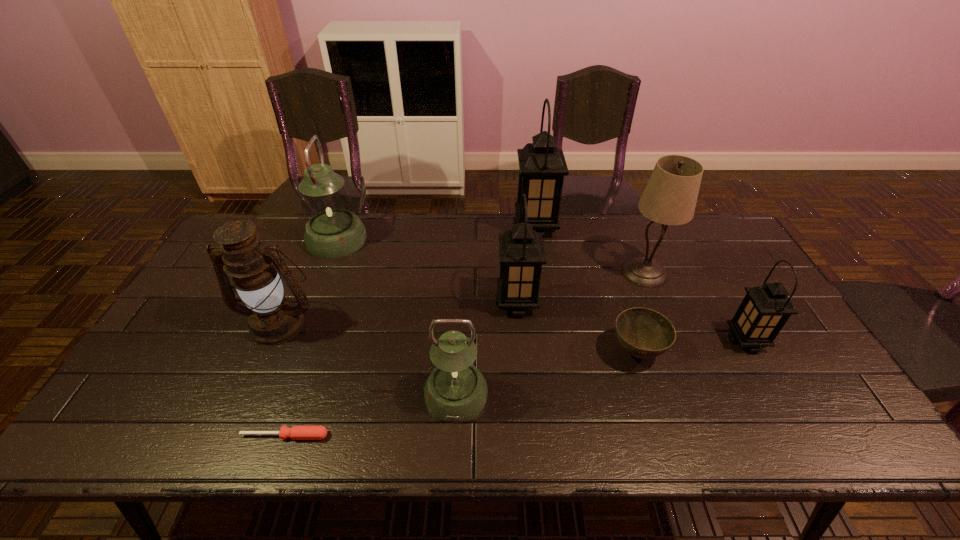
You are a GUI agent. You are given a task and a screenshot of the screen. Output one action in this format:
    pyautogui.click(x=<x>, y=<y>)
    Task: Click on the vacant space at the far edge of the desktop
    The width and height of the screenshot is (960, 540).
    Given the screenshot: What is the action you would take?
    pyautogui.click(x=471, y=227)

You are a GUI agent. You are given a task and a screenshot of the screen. Output one action in this format:
    pyautogui.click(x=<x>, y=<y>)
    Task: Click on the free space at the near edge of the desktop
    The width and height of the screenshot is (960, 540).
    Given the screenshot: What is the action you would take?
    pyautogui.click(x=342, y=447)

In the image, there is a desktop. Where is `free space at the left edge`? The image size is (960, 540). free space at the left edge is located at coordinates (210, 269).

Locate an element on the screen. blank area at the right edge is located at coordinates (808, 374).

At what (x,y) coordinates should I click in order to perform the action: click on free space at the near right corner of the desktop. Please return your answer as a coordinate pair (x, y). Looking at the image, I should click on (834, 442).

Where is `unoccupied area between the tallest lantern and the oil lamp`? Image resolution: width=960 pixels, height=540 pixels. unoccupied area between the tallest lantern and the oil lamp is located at coordinates (407, 275).

Locate an element on the screen. This screenshot has width=960, height=540. unoccupied position between the lampshade and the oil lamp is located at coordinates (462, 298).

The height and width of the screenshot is (540, 960). I want to click on free space between the rightmost black lantern and the leftmost lantern, so click(x=541, y=291).

Identify the location of free space that is in between the lampshade and the biggest black lantern. (589, 251).

Find the location of `free point between the lampshade and the smallest black lantern`. free point between the lampshade and the smallest black lantern is located at coordinates (695, 307).